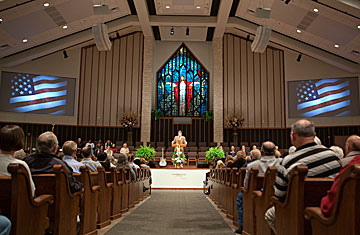
Locate an element on the screen. Image resolution: width=360 pixels, height=235 pixels. flower wreath is located at coordinates (181, 160).